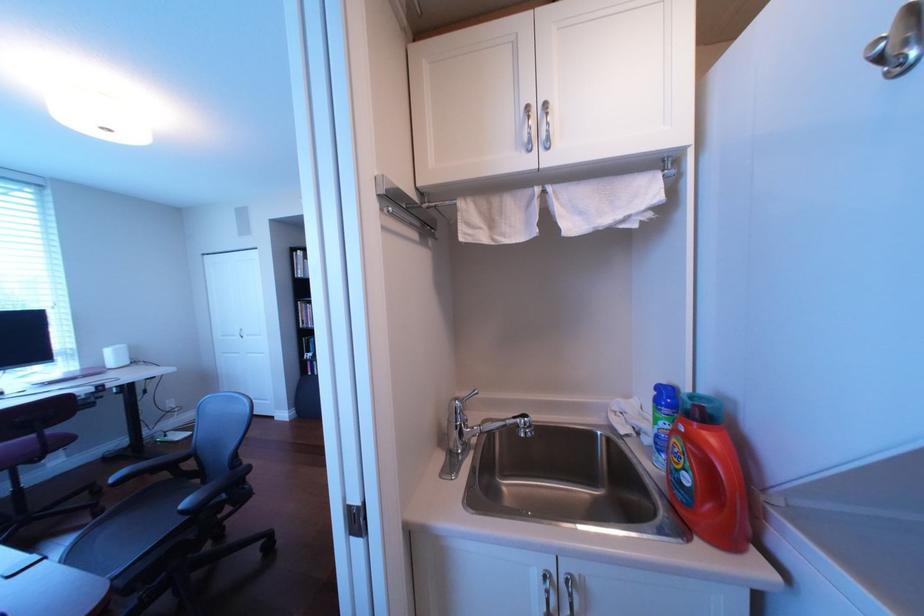
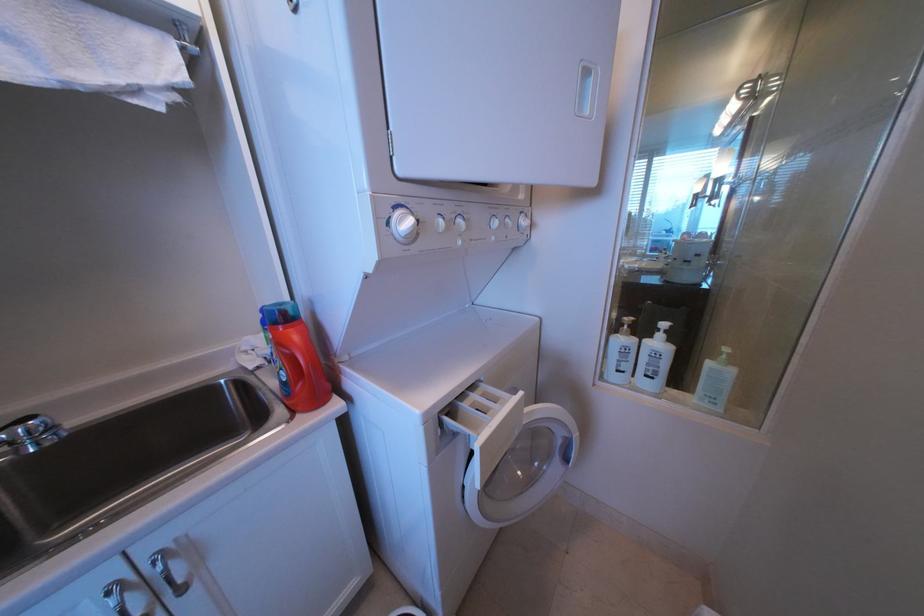
Question: How did the camera likely rotate?

Choices:
 (A) Left
 (B) Right
 (C) Up
 (D) Down

Answer: (B)